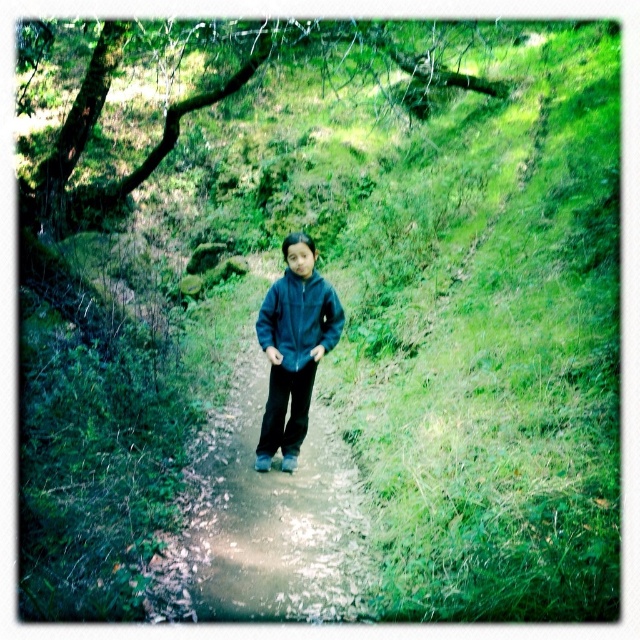
You are a fashion designer observing two jackets in an outdoor setting. You notice the dark blue fleece jacket at center and the matte blue jacket at center. Which jacket is positioned closer to you?

The dark blue fleece jacket at center is closer to the viewer than the matte blue jacket at center.

You are standing on the path and want to walk towards both the point at coordinates (326, 348) and the point at (333, 300). Which point will you reach first?

You will reach point (326, 348) first because it is closer to you than point (333, 300).